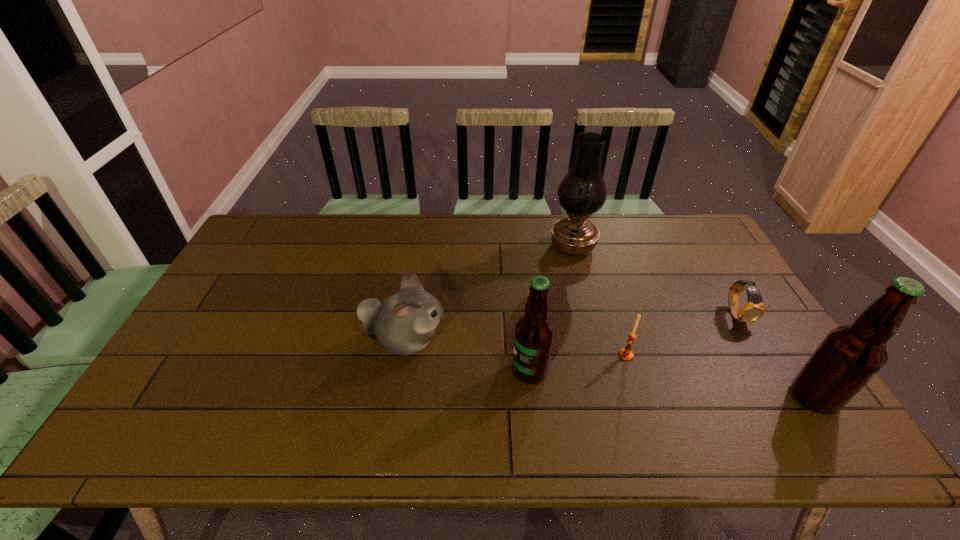
The image size is (960, 540). In order to click on free region located on the label of the second object from left to right in this screenshot , I will do `click(359, 371)`.

You are a GUI agent. You are given a task and a screenshot of the screen. Output one action in this format:
    pyautogui.click(x=<x>, y=<y>)
    Task: Click on the free space located 0.320m on the left of the oil lamp
    The width and height of the screenshot is (960, 540).
    Given the screenshot: What is the action you would take?
    pyautogui.click(x=456, y=247)

Find the location of a particular element. The width and height of the screenshot is (960, 540). free spot located 0.090m on the right of the second shortest object is located at coordinates (667, 355).

Find the location of `free space located 0.140m on the face of the watch`. free space located 0.140m on the face of the watch is located at coordinates (770, 370).

Locate an element on the screen. vacant space located on the face of the hamster is located at coordinates (519, 341).

At what (x,y) coordinates should I click in order to perform the action: click on object that is positioned at the far edge. Please return your answer as a coordinate pair (x, y). The image size is (960, 540). Looking at the image, I should click on coord(582,192).

At what (x,y) coordinates should I click in order to perform the action: click on beer bottle at the right edge. Please return your answer as a coordinate pair (x, y). Looking at the image, I should click on (849, 357).

This screenshot has height=540, width=960. Find the location of `watch situated at the right edge`. watch situated at the right edge is located at coordinates (754, 309).

Identify the location of object located in the near right corner section of the desktop. The height and width of the screenshot is (540, 960). (849, 357).

Find the location of a particular element. blank space at the far edge is located at coordinates pyautogui.click(x=386, y=247).